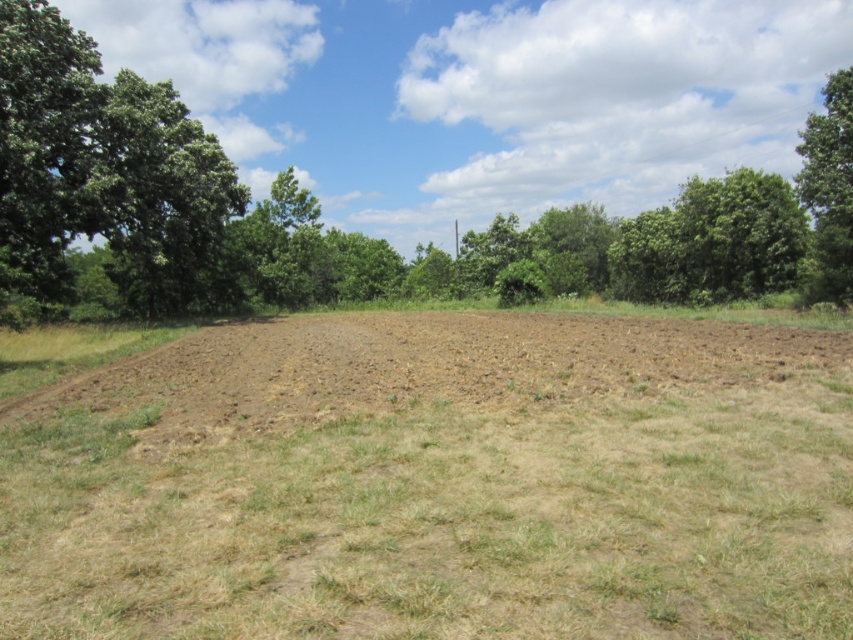
Does point (28, 64) lie behind point (80, 388)?

That is True.

Can you confirm if green leafy tree at center is positioned above brown soil at center?

Indeed, green leafy tree at center is positioned over brown soil at center.

Between point (463, 198) and point (590, 368), which one is positioned behind?

The point (463, 198) is behind.

The image size is (853, 640). I want to click on green leafy tree at center, so click(436, 170).

Locate an element on the screen. brown soil at center is located at coordinates (419, 365).

Is brown soil at center below green leafy tree at left?

Correct, brown soil at center is located below green leafy tree at left.

The image size is (853, 640). I want to click on brown soil at center, so click(419, 365).

Does green leafy tree at center have a lesser height compared to green leafy tree at left?

Incorrect, green leafy tree at center's height does not fall short of green leafy tree at left's.

Is point (274, 280) closer to camera compared to point (0, 186)?

No, it is not.

I want to click on green leafy tree at center, so click(436, 170).

Where is `green leafy tree at center`? green leafy tree at center is located at coordinates (436, 170).